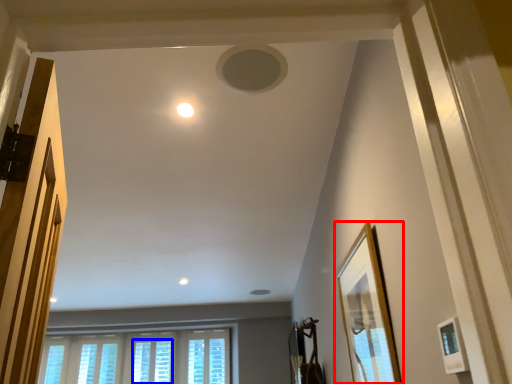
Question: Which of the following is the closest to the observer, picture frame (highlighted by a red box) or window (highlighted by a blue box)?

Choices:
 (A) picture frame
 (B) window

Answer: (A)